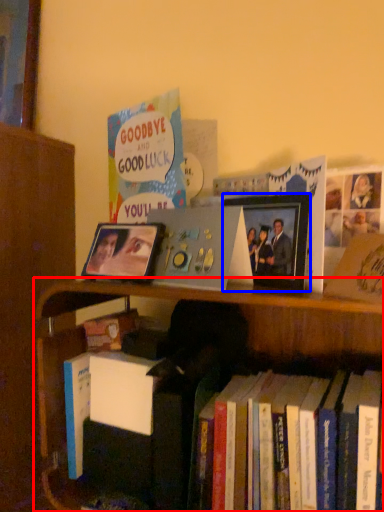
Question: Which object appears closest to the camera in this image, bookcase (highlighted by a red box) or picture frame (highlighted by a blue box)?

Choices:
 (A) bookcase
 (B) picture frame

Answer: (A)